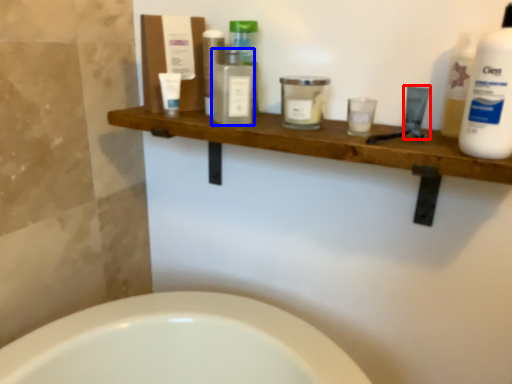
Question: Which point is closer to the camera, toiletry (highlighted by a red box) or toiletry (highlighted by a blue box)?

Choices:
 (A) toiletry
 (B) toiletry

Answer: (A)